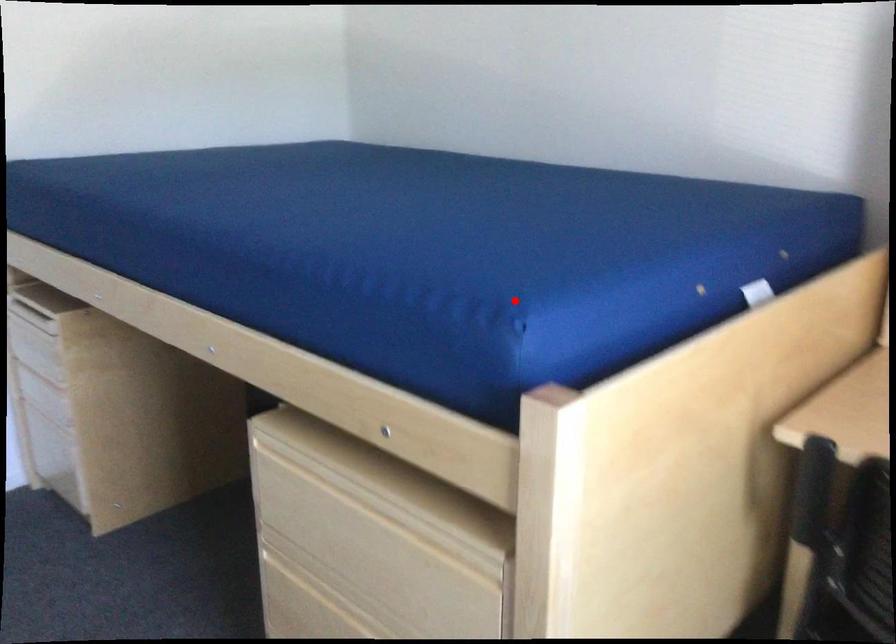
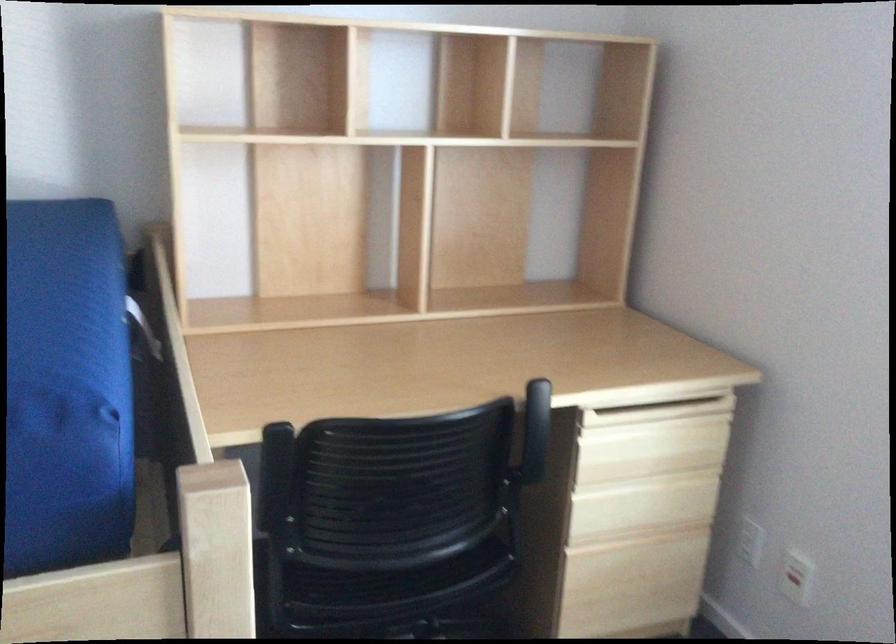
Question: A red point is marked in image1. In image2, is the corresponding 3D point closer to the camera or farther? Reply with the corresponding letter.

Choices:
 (A) The corresponding 3D point is closer.
 (B) The corresponding 3D point is farther.

Answer: (A)